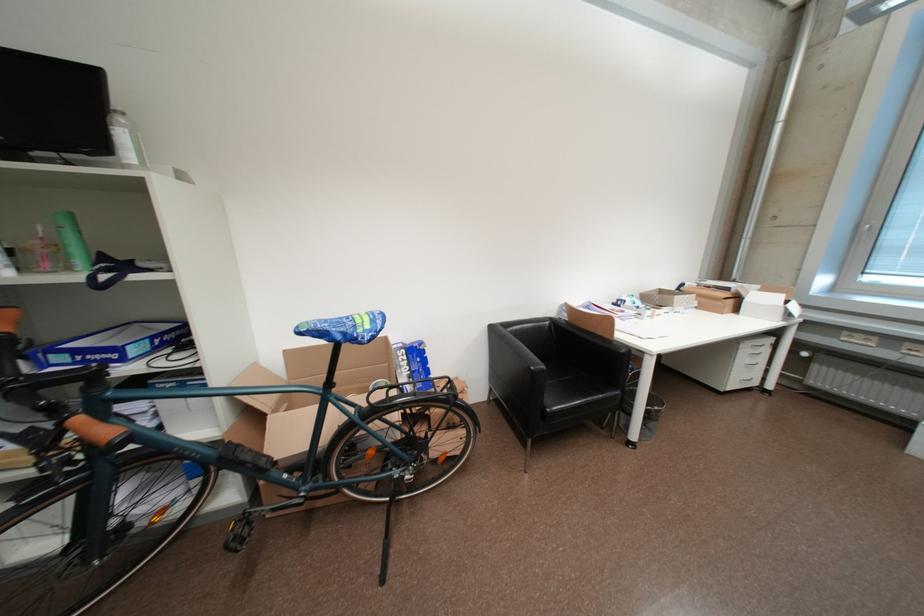
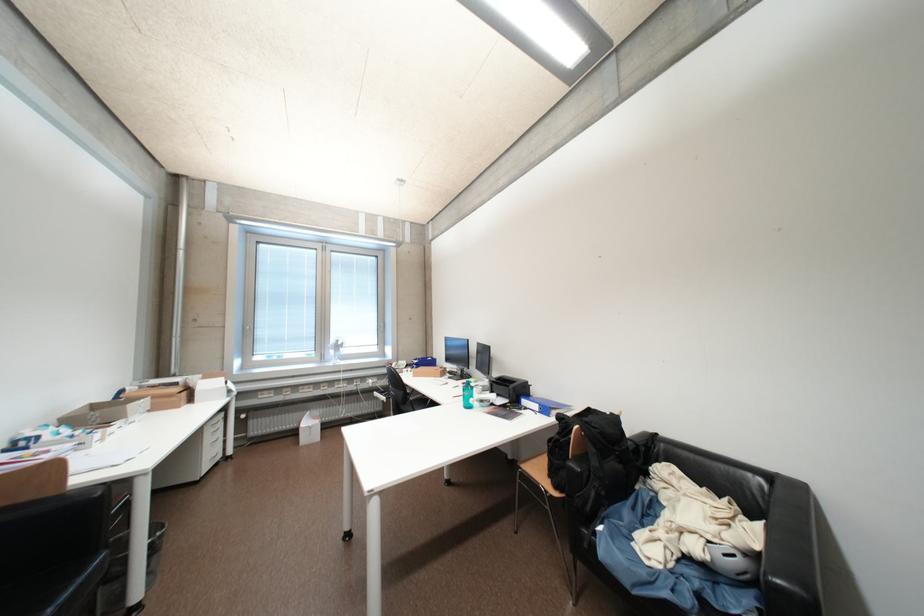
The point at (738, 302) is marked in the first image. Where is the corresponding point in the second image?

(192, 395)